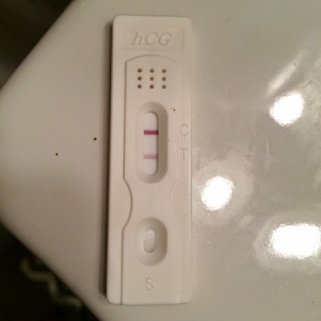
You are a GUI agent. You are given a task and a screenshot of the screen. Output one action in this format:
    pyautogui.click(x=<x>, y=<y>)
    Task: Click on the counter
    
    Given the screenshot: What is the action you would take?
    pyautogui.click(x=240, y=49)